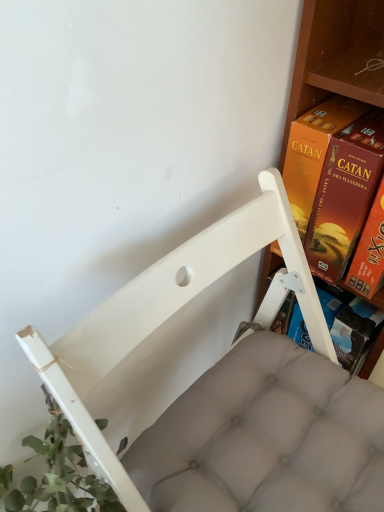
Locate an element on the screen. This screenshot has height=512, width=384. white fabric chair at center is located at coordinates (173, 314).

Describe the element at coordinates (173, 314) in the screenshot. I see `white fabric chair at center` at that location.

This screenshot has width=384, height=512. What do you see at coordinates (333, 179) in the screenshot? I see `orange cardboard game at right` at bounding box center [333, 179].

Image resolution: width=384 pixels, height=512 pixels. What are the coordinates of `orange cardboard game at right` in the screenshot? It's located at (333, 179).

Image resolution: width=384 pixels, height=512 pixels. In order to click on white fabric chair at center in this screenshot , I will do pos(173,314).

Which object is positioned more to the left, orange cardboard game at right or white fabric chair at center?

Positioned to the left is white fabric chair at center.

Based on the photo, is the position of orange cardboard game at right less distant than that of white fabric chair at center?

No.

Is point (354, 121) behind point (91, 332)?

Yes, it is behind point (91, 332).

From the image's perspective, which object appears higher, orange cardboard game at right or white fabric chair at center?

orange cardboard game at right, from the image's perspective.

From a real-world perspective, which object stands above the other?

From a 3D spatial view, orange cardboard game at right is above.

Is orange cardboard game at right thinner than white fabric chair at center?

Yes.

Considering the relative sizes of orange cardboard game at right and white fabric chair at center in the image provided, is orange cardboard game at right shorter than white fabric chair at center?

Yes.

Considering the relative sizes of orange cardboard game at right and white fabric chair at center in the image provided, is orange cardboard game at right bigger than white fabric chair at center?

Incorrect, orange cardboard game at right is not larger than white fabric chair at center.

Is orange cardboard game at right situated inside white fabric chair at center or outside?

orange cardboard game at right exists outside the volume of white fabric chair at center.

Is orange cardboard game at right positioned far away from white fabric chair at center?

No, there isn't a large distance between orange cardboard game at right and white fabric chair at center.

In the scene shown: Is orange cardboard game at right facing away from white fabric chair at center?

No, orange cardboard game at right is not facing the opposite direction of white fabric chair at center.

In order to click on book that is on the right side of white fabric chair at center in this screenshot , I will do `click(333, 179)`.

Would you say white fabric chair at center is to the left or to the right of orange cardboard game at right in the picture?

Clearly, white fabric chair at center is on the left of orange cardboard game at right in the image.

Considering the positions of objects white fabric chair at center and orange cardboard game at right in the image provided, who is in front, white fabric chair at center or orange cardboard game at right?

Positioned in front is white fabric chair at center.

Which is more distant, (34, 351) or (343, 132)?

Point (343, 132)

From the image's perspective, which object appears higher, white fabric chair at center or orange cardboard game at right?

orange cardboard game at right, from the image's perspective.

From a real-world perspective, is white fabric chair at center on orange cardboard game at right?

Actually, white fabric chair at center is physically below orange cardboard game at right in the real world.

From the picture: Considering the sizes of white fabric chair at center and orange cardboard game at right in the image, is white fabric chair at center wider or thinner than orange cardboard game at right?

white fabric chair at center is wider than orange cardboard game at right.

Does white fabric chair at center have a lesser height compared to orange cardboard game at right?

In fact, white fabric chair at center may be taller than orange cardboard game at right.

Considering the relative sizes of white fabric chair at center and orange cardboard game at right in the image provided, is white fabric chair at center smaller than orange cardboard game at right?

No, white fabric chair at center is not smaller than orange cardboard game at right.

Would you say white fabric chair at center is inside or outside orange cardboard game at right?

white fabric chair at center exists outside the volume of orange cardboard game at right.

Would you say white fabric chair at center is a long distance from orange cardboard game at right?

No, there isn't a large distance between white fabric chair at center and orange cardboard game at right.

Is white fabric chair at center turned away from orange cardboard game at right?

white fabric chair at center is not turned away from orange cardboard game at right.

How far apart are white fabric chair at center and orange cardboard game at right?

white fabric chair at center and orange cardboard game at right are 8.62 inches apart from each other.

The width and height of the screenshot is (384, 512). In order to click on furniture that is below the orange cardboard game at right (from the image's perspective) in this screenshot , I will do `click(173, 314)`.

Where is `book above the white fabric chair at center (from a real-world perspective)`? This screenshot has width=384, height=512. book above the white fabric chair at center (from a real-world perspective) is located at coordinates (333, 179).

The width and height of the screenshot is (384, 512). Find the location of `book behind the white fabric chair at center`. book behind the white fabric chair at center is located at coordinates (333, 179).